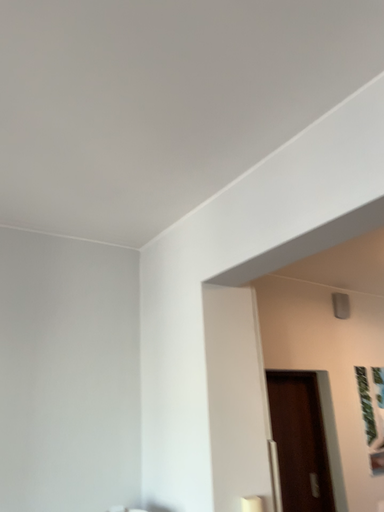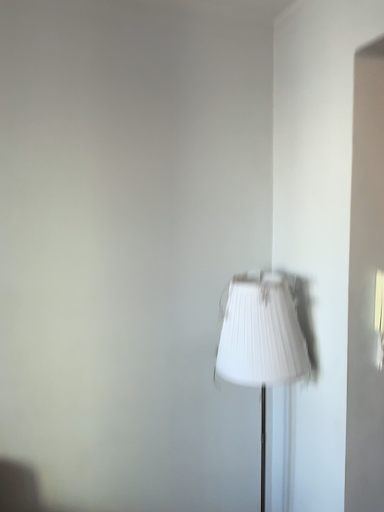
Question: Which way did the camera rotate in the video?

Choices:
 (A) rotated upward
 (B) rotated downward

Answer: (B)